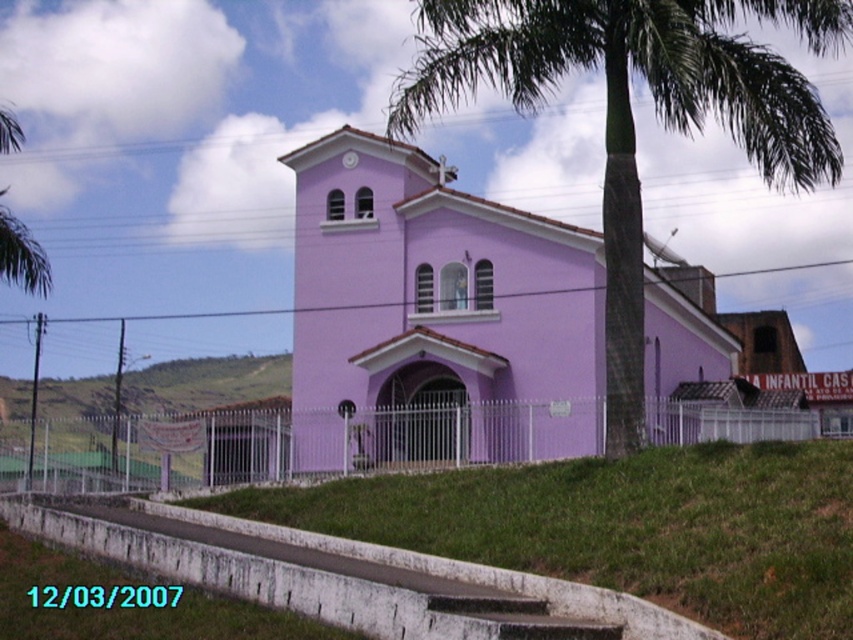
You are standing at the entrance of the church and want to take a photo of the green leafy palm tree at center and the green grassy hillside at lower left. Which object will appear closer to the camera in the photo?

The green leafy palm tree at center will appear closer to the camera in the photo because it is positioned in front of the green grassy hillside at lower left.

You are standing at the camera position and want to reach the point marked as point (593, 410). If you walk straight ahead, will you reach that point before walking 50 meters?

The distance between you and point (593, 410) is 51.05 meters. Since you need to walk 51.05 meters to reach it, you will not reach the point before walking 50 meters.